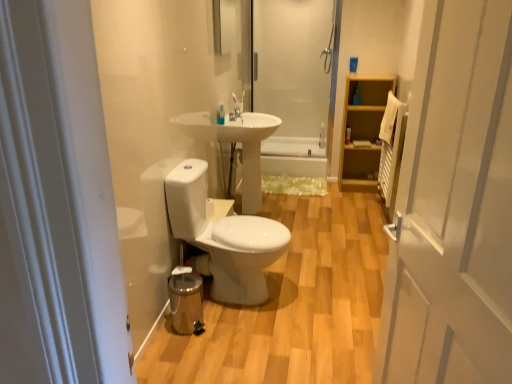
This screenshot has height=384, width=512. What do you see at coordinates (293, 156) in the screenshot?
I see `white glossy bathtub at center` at bounding box center [293, 156].

Describe the element at coordinates (454, 206) in the screenshot. This screenshot has width=512, height=384. I see `white glossy door at right` at that location.

Locate an element on the screen. This screenshot has height=384, width=512. transparent glass shower door at upper center is located at coordinates (294, 73).

Where is `light wood cabinet at right`? light wood cabinet at right is located at coordinates (362, 133).

Image resolution: width=512 pixels, height=384 pixels. What do you see at coordinates (220, 114) in the screenshot?
I see `white glossy toothbrush at upper center, which is counted as the second toiletry, starting from the back` at bounding box center [220, 114].

You are a GUI agent. You are given a task and a screenshot of the screen. Output one action in this format:
    pyautogui.click(x=<x>, y=<y>)
    Task: Click on the white glossy toilet at center
    Image resolution: width=512 pixels, height=384 pixels.
    Given the screenshot: What is the action you would take?
    pyautogui.click(x=222, y=237)

This screenshot has width=512, height=384. Find the location of `white glossy toilet at center`. white glossy toilet at center is located at coordinates (293, 305).

Does white glossy sink at center turn towards white glossy bathtub at center?

No.

Between white glossy sink at center and white glossy bathtub at center, which one has less height?

white glossy bathtub at center is shorter.

Is white glossy sink at center not close to white glossy bathtub at center?

Absolutely, white glossy sink at center is distant from white glossy bathtub at center.

Locate an element on the screen. bath behind the white glossy sink at center is located at coordinates (293, 156).

Which is behind, point (262, 168) or point (182, 187)?

The point (262, 168) is farther.

From the image's perspective, between white glossy bathtub at center and white glossy toilet at center, who is located below?

white glossy toilet at center.

Identify the location of bath beneath the white glossy toilet at center (from a real-world perspective). (293, 156).

Between white glossy bathtub at center and white glossy toilet at center, which one is positioned in front?

white glossy toilet at center is closer to the camera.

From a real-world perspective, who is located higher, glossy glass mirror at upper center or white glossy bathtub at center?

glossy glass mirror at upper center is physically above.

Locate an element on the screen. This screenshot has height=384, width=512. bath below the glossy glass mirror at upper center (from a real-world perspective) is located at coordinates (293, 156).

Is glossy glass mirror at upper center oriented towards white glossy bathtub at center?

No, glossy glass mirror at upper center is not aimed at white glossy bathtub at center.

Does glossy glass mirror at upper center come in front of white glossy bathtub at center?

Yes, glossy glass mirror at upper center is closer to the viewer.

You are a GUI agent. You are given a task and a screenshot of the screen. Output one action in this format:
    pyautogui.click(x=<x>, y=<y>)
    Task: Click on the plain located in front of the white glossy toothbrush at upper center, placed as the 2th toiletry when sorted from right to left
    This screenshot has height=384, width=512.
    Given the screenshot: What is the action you would take?
    293,305

Is point (218, 119) closer or farther from the camera than point (321, 315)?

Point (218, 119) is farther from the camera than point (321, 315).

Is white glossy toothbrush at upper center, the first toiletry positioned from the front, turned away from white glossy toilet at center?

No, white glossy toothbrush at upper center, the first toiletry positioned from the front,'s orientation is not away from white glossy toilet at center.

Can you tell me how much white glossy toothbrush at upper center, the first toiletry positioned from the front, and white glossy toilet at center differ in facing direction?

The angular difference between white glossy toothbrush at upper center, the first toiletry positioned from the front, and white glossy toilet at center is 93.4 degrees.

In terms of height, does glossy glass mirror at upper center look taller or shorter compared to white glossy sink at center?

In the image, glossy glass mirror at upper center appears to be shorter than white glossy sink at center.

From the picture: From the image's perspective, does glossy glass mirror at upper center appear higher than white glossy sink at center?

Yes, from the image's perspective, glossy glass mirror at upper center is over white glossy sink at center.

Choose the correct answer: Is glossy glass mirror at upper center inside white glossy sink at center or outside it?

glossy glass mirror at upper center is spatially situated outside white glossy sink at center.

Do you think white glossy bathtub at center is within glossy glass mirror at upper center, or outside of it?

white glossy bathtub at center is outside glossy glass mirror at upper center.

From a real-world perspective, which is physically below, white glossy bathtub at center or glossy glass mirror at upper center?

white glossy bathtub at center.

Identify the location of bath directly beneath the glossy glass mirror at upper center (from a real-world perspective). This screenshot has height=384, width=512. (293, 156).

How different are the orientations of white glossy bathtub at center and glossy glass mirror at upper center in degrees?

90.6 degrees.

Is white glossy door at right at the right side of white glossy toothbrush at upper center, which is counted as the second toiletry, starting from the back?

Yes.

Is white glossy door at right bigger or smaller than white glossy toothbrush at upper center, the first toiletry positioned from the front?

In the image, white glossy door at right appears to be larger than white glossy toothbrush at upper center, the first toiletry positioned from the front.

Considering the relative sizes of white glossy door at right and white glossy toothbrush at upper center, the first toiletry positioned from the front, in the image provided, is white glossy door at right taller than white glossy toothbrush at upper center, the first toiletry positioned from the front,?

Yes, white glossy door at right is taller than white glossy toothbrush at upper center, the first toiletry positioned from the front.

Would you say white glossy door at right is outside white glossy toothbrush at upper center, the first toiletry positioned from the front?

That's correct, white glossy door at right is outside of white glossy toothbrush at upper center, the first toiletry positioned from the front.

The width and height of the screenshot is (512, 384). I want to click on bath located behind the white glossy sink at center, so click(x=293, y=156).

This screenshot has height=384, width=512. In order to click on toilet that appears on the left of white glossy bathtub at center in this screenshot , I will do `click(222, 237)`.

Looking at the image, which one is located closer to white glossy bathtub at center, light wood cabinet at right or white glossy toilet at center?

Based on the image, light wood cabinet at right appears to be nearer to white glossy bathtub at center.

Estimate the real-world distances between objects in this image. Which object is closer to white glossy toilet at center, white glossy bathtub at center or translucent plastic bottle at upper right, acting as the 2th toiletry starting from the front?

translucent plastic bottle at upper right, acting as the 2th toiletry starting from the front, is closer to white glossy toilet at center.

When comparing their distances from white glossy door at right, does white glossy toilet at center or white glossy bathtub at center seem further?

white glossy bathtub at center is positioned further to the anchor white glossy door at right.

Which object lies further to the anchor point white glossy toilet at center, glossy glass mirror at upper center or white glossy door at right?

Based on the image, glossy glass mirror at upper center appears to be further to white glossy toilet at center.

Considering their positions, is glossy glass mirror at upper center positioned closer to white glossy toothbrush at upper center, placed as the 2th toiletry when sorted from right to left, than light wood cabinet at right?

The object closer to white glossy toothbrush at upper center, placed as the 2th toiletry when sorted from right to left, is glossy glass mirror at upper center.

Based on their spatial positions, is white glossy toilet at center or light wood cabinet at right further from white glossy toilet at center?

light wood cabinet at right.

Considering their positions, is transparent glass shower door at upper center positioned further to translucent plastic bottle at upper right, positioned as the 2th toiletry in left-to-right order, than white glossy toothbrush at upper center, which is counted as the second toiletry, starting from the back?

white glossy toothbrush at upper center, which is counted as the second toiletry, starting from the back.

Estimate the real-world distances between objects in this image. Which object is further from white glossy door at right, glossy glass mirror at upper center or translucent plastic bottle at upper right, acting as the 2th toiletry starting from the front?

The object further to white glossy door at right is translucent plastic bottle at upper right, acting as the 2th toiletry starting from the front.

Image resolution: width=512 pixels, height=384 pixels. Identify the location of shower door between white glossy sink at center and translucent plastic bottle at upper right, which is the 1th toiletry in right-to-left order, from front to back. (294, 73).

At what (x,y) coordinates should I click in order to perform the action: click on sink between white glossy toilet at center and translucent plastic bottle at upper right, acting as the 2th toiletry starting from the front, from front to back. Please return your answer as a coordinate pair (x, y). Looking at the image, I should click on (234, 143).

What are the coordinates of `toiletry located between white glossy toothbrush at upper center, placed as the 2th toiletry when sorted from right to left, and light wood cabinet at right in the left-right direction` in the screenshot? It's located at (348, 135).

You are a GUI agent. You are given a task and a screenshot of the screen. Output one action in this format:
    pyautogui.click(x=<x>, y=<y>)
    Task: Click on the toiletry positioned between white glossy toilet at center and translucent plastic bottle at upper right, which is the 1th toiletry in right-to-left order, from near to far
    This screenshot has width=512, height=384.
    Given the screenshot: What is the action you would take?
    pyautogui.click(x=220, y=114)